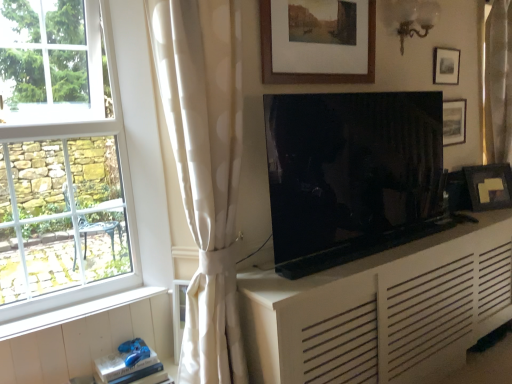
Question: From the image's perspective, is white matte cabinet at center over matte black tv at center?

Choices:
 (A) yes
 (B) no

Answer: (B)

Question: From a real-world perspective, does white matte cabinet at center sit lower than matte black tv at center?

Choices:
 (A) no
 (B) yes

Answer: (B)

Question: Is matte black tv at center surrounded by white matte cabinet at center?

Choices:
 (A) yes
 (B) no

Answer: (B)

Question: Could you tell me if white matte cabinet at center is facing matte black tv at center?

Choices:
 (A) no
 (B) yes

Answer: (A)

Question: Is white matte cabinet at center to the right of matte black tv at center from the viewer's perspective?

Choices:
 (A) yes
 (B) no

Answer: (A)

Question: Is white matte cabinet at center shorter than matte black tv at center?

Choices:
 (A) yes
 (B) no

Answer: (B)

Question: From the image's perspective, does white dotted fabric at center, marked as the second curtain in a back-to-front arrangement, appear lower than matte black picture frame at upper right, the 2th picture frame from the left?

Choices:
 (A) no
 (B) yes

Answer: (B)

Question: Is white dotted fabric at center, positioned as the first curtain in left-to-right order, far from matte black picture frame at upper right, which ranks as the 3th picture frame in back-to-front order?

Choices:
 (A) yes
 (B) no

Answer: (A)

Question: Can you confirm if white dotted fabric at center, positioned as the first curtain in left-to-right order, is wider than matte black picture frame at upper right, which ranks as the 3th picture frame in back-to-front order?

Choices:
 (A) yes
 (B) no

Answer: (A)

Question: Does white dotted fabric at center, the second curtain from the right, have a larger size compared to matte black picture frame at upper right, marked as the 2th picture frame in a front-to-back arrangement?

Choices:
 (A) no
 (B) yes

Answer: (B)

Question: Is white dotted fabric at center, marked as the second curtain in a back-to-front arrangement, located outside matte black picture frame at upper right, the 2th picture frame from the left?

Choices:
 (A) yes
 (B) no

Answer: (A)

Question: Does white dotted fabric at center, positioned as the first curtain in left-to-right order, turn towards matte black picture frame at upper right, which ranks as the 3th picture frame in back-to-front order?

Choices:
 (A) yes
 (B) no

Answer: (B)

Question: Does matte black picture frame at right, arranged as the 4th picture frame when viewed from the left, come behind white wood at lower left?

Choices:
 (A) no
 (B) yes

Answer: (B)